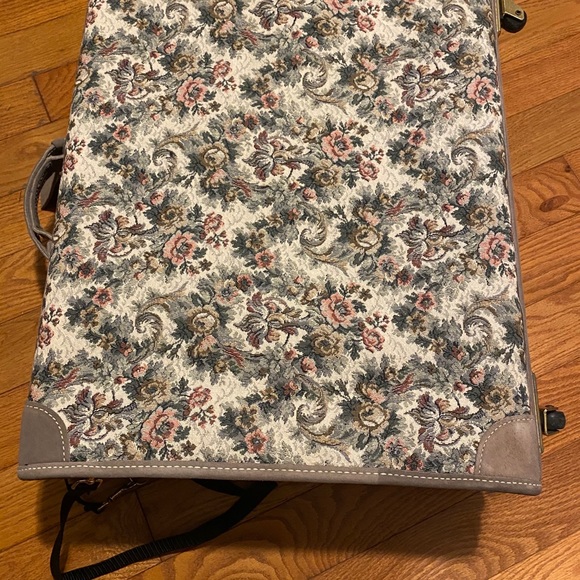
This screenshot has height=580, width=580. In order to click on hardwood floor in this screenshot , I will do `click(556, 126)`.